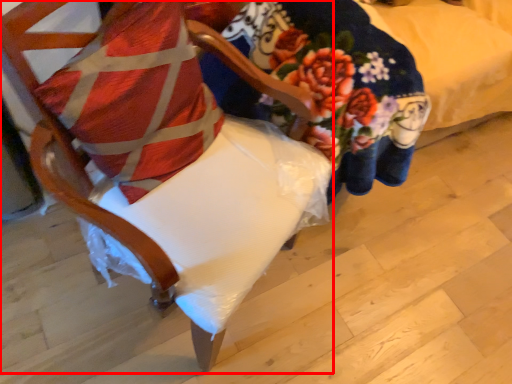
Question: From the image's perspective, where is chair (annotated by the red box) located relative to pillow?

Choices:
 (A) above
 (B) below

Answer: (B)